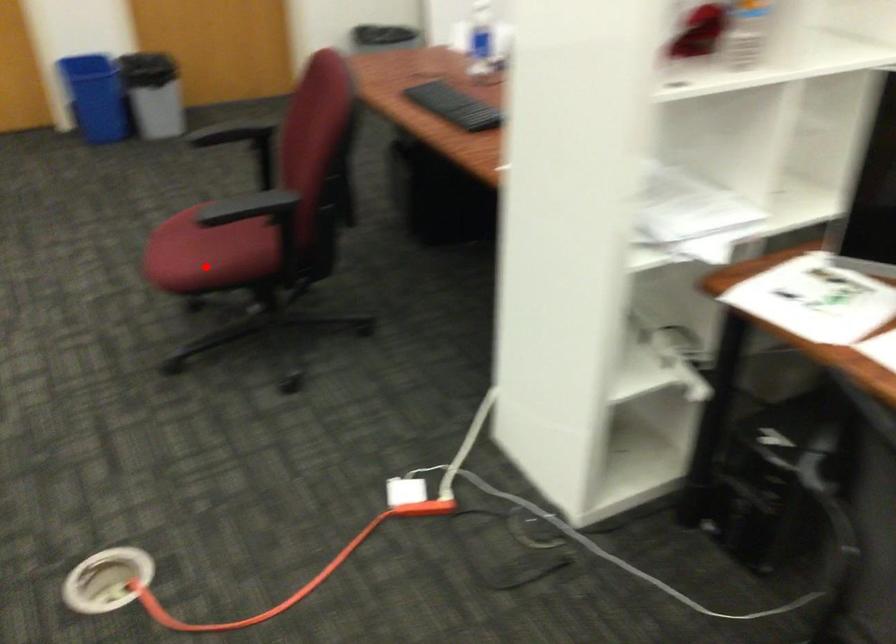
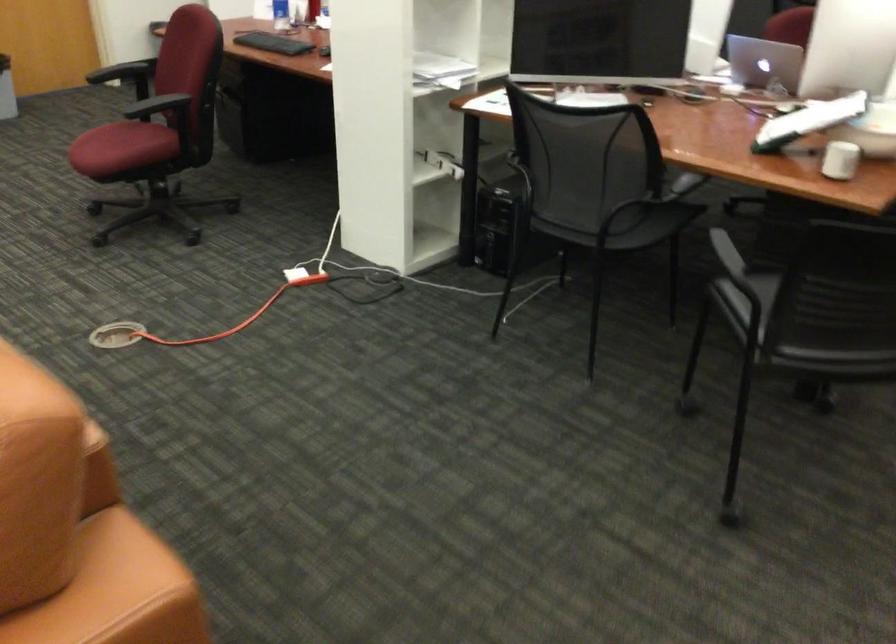
Question: I am providing you with two images of the same scene from different viewpoints. A red point is shown in image1. For the corresponding object point in image2, is it positioned nearer or farther from the camera?

Choices:
 (A) Nearer
 (B) Farther

Answer: (B)